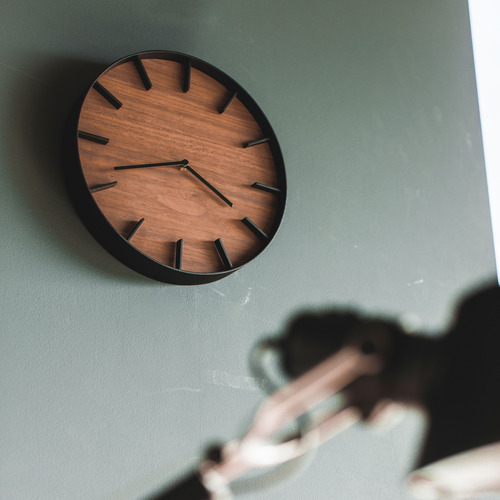
The height and width of the screenshot is (500, 500). In order to click on clock hands in this screenshot , I will do `click(195, 174)`, `click(141, 165)`.